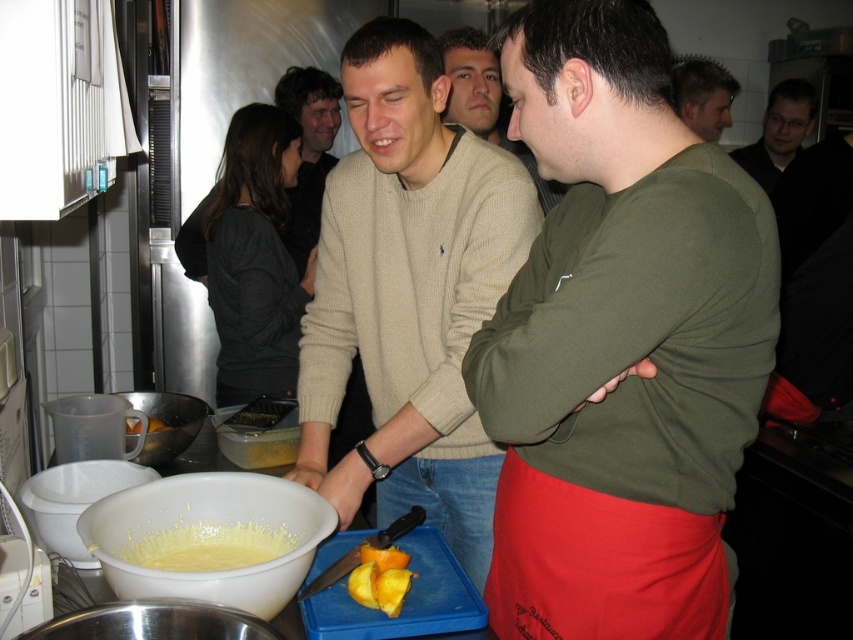
Question: Considering the real-world distances, which object is closest to the yellow creamy batter at lower center?

Choices:
 (A) matte white bowl at lower left
 (B) white plastic bowl at lower center
 (C) translucent plastic container at center

Answer: (B)

Question: Estimate the real-world distances between objects in this image. Which object is closer to the white plastic bowl at lower center?

Choices:
 (A) yellow creamy food at center
 (B) matte white bowl at lower left
 (C) matte beige sweater at center

Answer: (B)

Question: Can you confirm if dark gray sweater at center is positioned above matte white bowl at lower left?

Choices:
 (A) no
 (B) yes

Answer: (B)

Question: Can you confirm if white plastic bowl at lower center is bigger than matte beige sweater at center?

Choices:
 (A) yes
 (B) no

Answer: (B)

Question: Based on their relative distances, which object is nearer to the white plastic bowl at lower center?

Choices:
 (A) white matte bowl at lower left
 (B) beige sweater at center
 (C) yellow matte batter at lower left
 (D) brushed metal bowl at lower left

Answer: (D)

Question: From the image, what is the correct spatial relationship of light beige sweater at center in relation to beige sweater at center?

Choices:
 (A) left
 (B) right

Answer: (A)